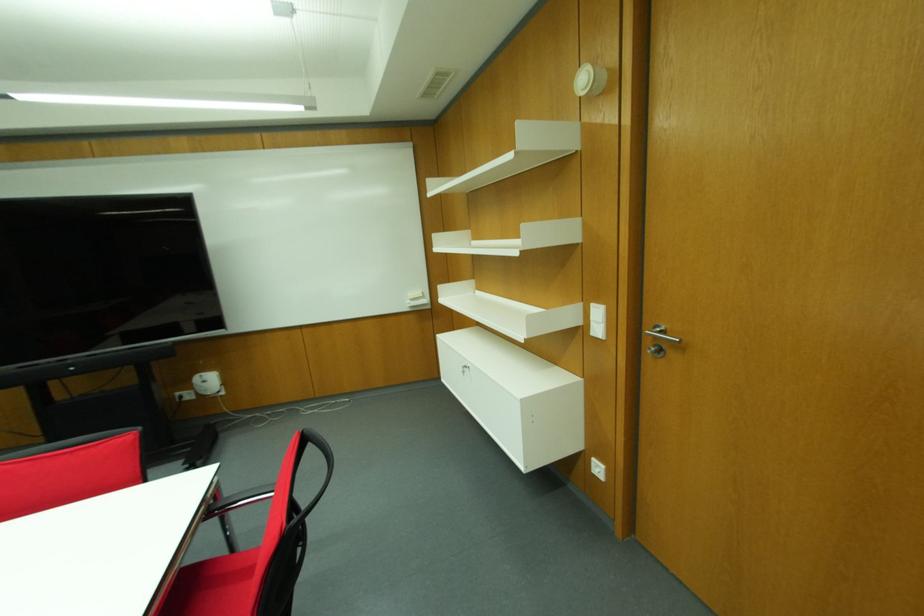
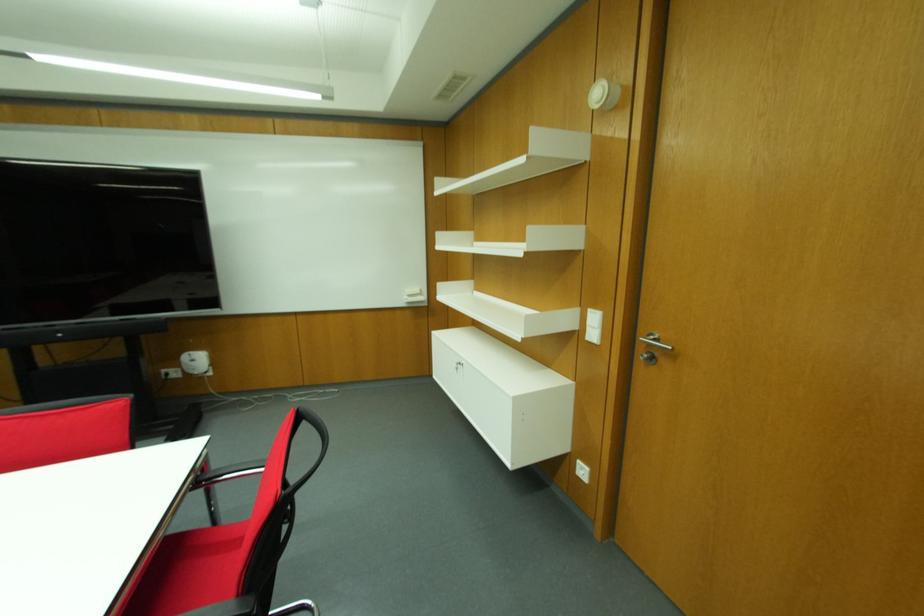
The images are taken continuously from a first-person perspective. In which direction are you moving?

The cameraman walked toward left, backward.